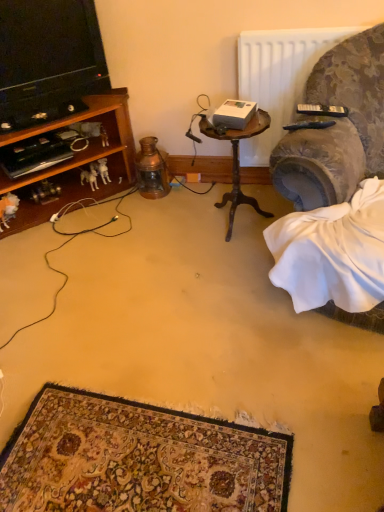
What are the coordinates of `empty space that is to the right of white plastic dog at lower left` in the screenshot? It's located at (120, 196).